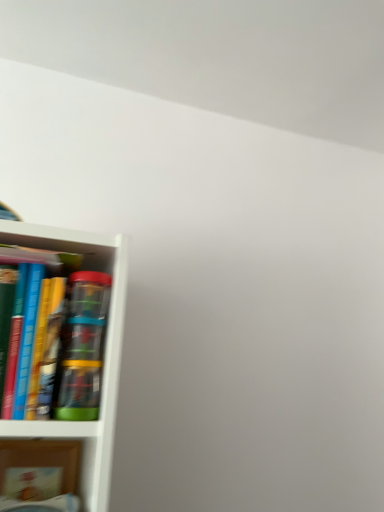
Question: Can you confirm if hardcover book at left, which is the second book in bottom-to-top order, is wider than matte cardboard book at lower left, which is the second book from top to bottom?

Choices:
 (A) yes
 (B) no

Answer: (A)

Question: Is the depth of hardcover book at left, the first book when ordered from top to bottom, less than that of matte cardboard book at lower left, which is the second book from top to bottom?

Choices:
 (A) yes
 (B) no

Answer: (A)

Question: Is hardcover book at left, the first book when ordered from top to bottom, located outside matte cardboard book at lower left, positioned as the first book in bottom-to-top order?

Choices:
 (A) no
 (B) yes

Answer: (B)

Question: Does hardcover book at left, which is the second book in bottom-to-top order, come behind matte cardboard book at lower left, positioned as the first book in bottom-to-top order?

Choices:
 (A) no
 (B) yes

Answer: (A)

Question: Is hardcover book at left, which is the second book in bottom-to-top order, shorter than matte cardboard book at lower left, which is the second book from top to bottom?

Choices:
 (A) yes
 (B) no

Answer: (B)

Question: From a real-world perspective, is hardcover book at left, the first book when ordered from top to bottom, over matte cardboard book at lower left, which is the second book from top to bottom?

Choices:
 (A) yes
 (B) no

Answer: (A)

Question: Is the position of matte cardboard book at lower left, which is the second book from top to bottom, more distant than that of hardcover book at left, which is the second book in bottom-to-top order?

Choices:
 (A) yes
 (B) no

Answer: (A)

Question: Are matte cardboard book at lower left, which is the second book from top to bottom, and hardcover book at left, the first book when ordered from top to bottom, far apart?

Choices:
 (A) no
 (B) yes

Answer: (A)

Question: Is matte cardboard book at lower left, which is the second book from top to bottom, next to hardcover book at left, which is the second book in bottom-to-top order, and touching it?

Choices:
 (A) yes
 (B) no

Answer: (B)

Question: Could you tell me if matte cardboard book at lower left, positioned as the first book in bottom-to-top order, is facing hardcover book at left, which is the second book in bottom-to-top order?

Choices:
 (A) yes
 (B) no

Answer: (B)

Question: From the image's perspective, is matte cardboard book at lower left, positioned as the first book in bottom-to-top order, located beneath hardcover book at left, the first book when ordered from top to bottom?

Choices:
 (A) no
 (B) yes

Answer: (B)

Question: Can you confirm if matte cardboard book at lower left, positioned as the first book in bottom-to-top order, is taller than hardcover book at left, which is the second book in bottom-to-top order?

Choices:
 (A) no
 (B) yes

Answer: (A)

Question: From a real-world perspective, is matte cardboard book at lower left, positioned as the first book in bottom-to-top order, positioned above or below hardcover book at left, which is the second book in bottom-to-top order?

Choices:
 (A) below
 (B) above

Answer: (A)